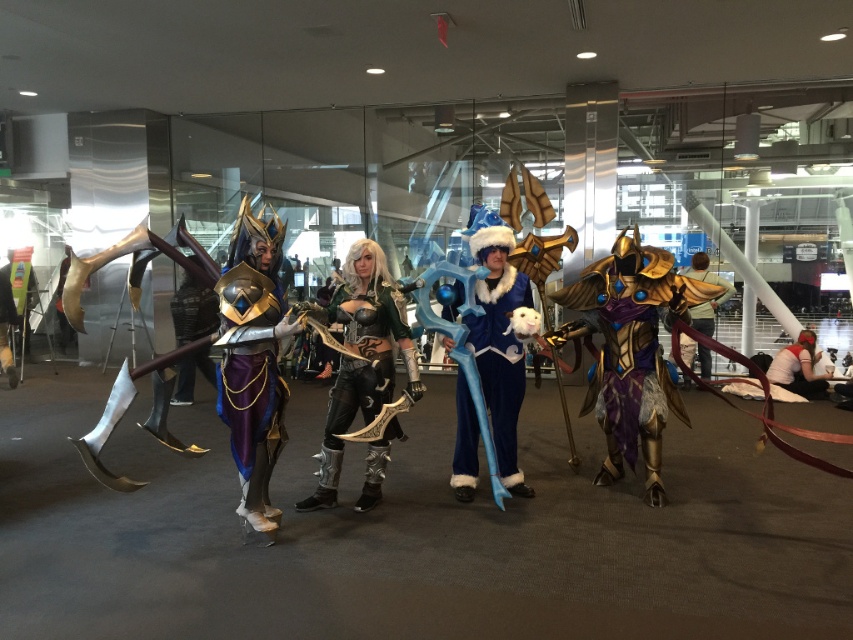
Which is more to the left, black leather armor at center or gold metallic armor at center?

black leather armor at center

Where is `black leather armor at center`? black leather armor at center is located at coordinates (364, 358).

Can you confirm if black leather armor at center is taller than white fabric shirt at lower right?

Correct, black leather armor at center is much taller as white fabric shirt at lower right.

Identify the location of black leather armor at center. (364, 358).

Locate an element on the screen. This screenshot has width=853, height=640. black leather armor at center is located at coordinates (364, 358).

Identify the location of gold metallic armor at right. The height and width of the screenshot is (640, 853). (631, 352).

Is point (602, 285) farther from viewer compared to point (492, 312)?

That is True.

Identify the location of gold metallic armor at right. (631, 352).